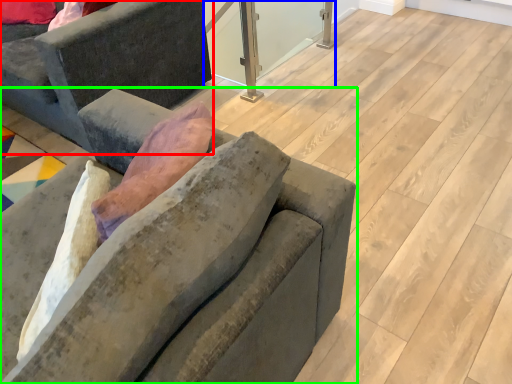
Question: Which object is the closest to the studio couch (highlighted by a red box)? Choose among these: window screen (highlighted by a blue box) or studio couch (highlighted by a green box).

Choices:
 (A) window screen
 (B) studio couch

Answer: (B)